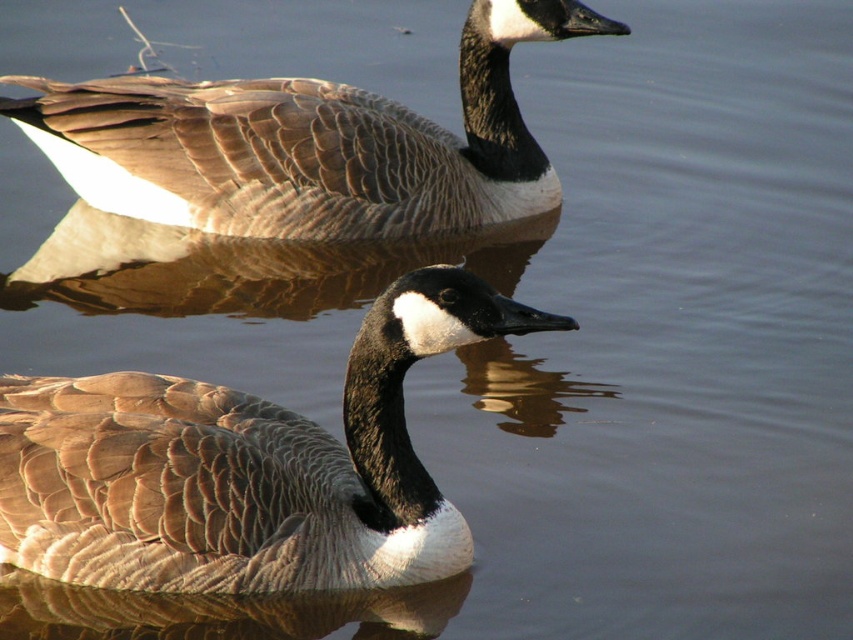
Who is shorter, brown feathered duck at center or brown feathered duck at upper center?

brown feathered duck at center is shorter.

In the scene shown: Measure the distance between brown feathered duck at center and brown feathered duck at upper center.

6.27 feet

At what (x,y) coordinates should I click in order to perform the action: click on brown feathered duck at center. Please return your answer as a coordinate pair (x, y). This screenshot has height=640, width=853. Looking at the image, I should click on (245, 467).

You are a GUI agent. You are given a task and a screenshot of the screen. Output one action in this format:
    pyautogui.click(x=<x>, y=<y>)
    Task: Click on the brown feathered duck at center
    This screenshot has width=853, height=640.
    Given the screenshot: What is the action you would take?
    pyautogui.click(x=245, y=467)